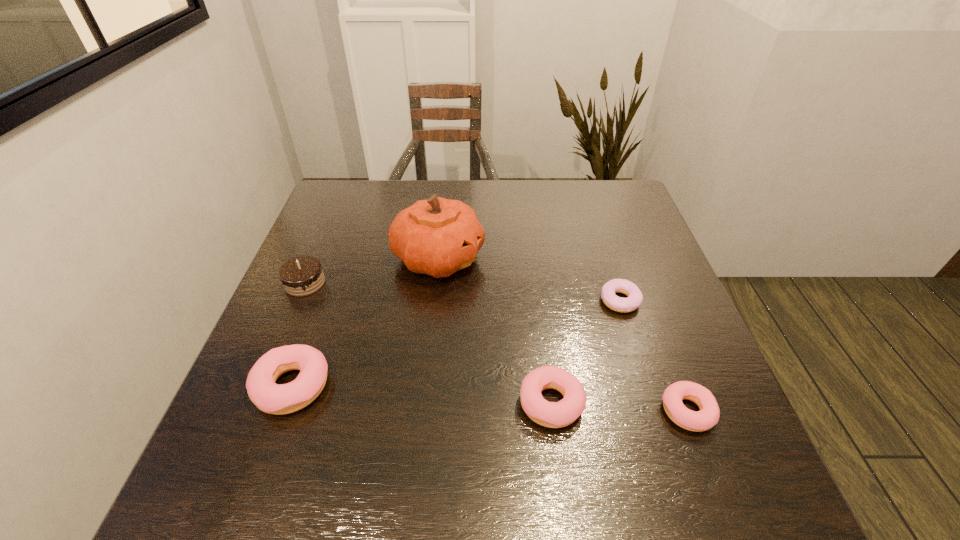
Where is `the second closest object relative to the farthest doughnut`? Image resolution: width=960 pixels, height=540 pixels. the second closest object relative to the farthest doughnut is located at coordinates (708, 416).

This screenshot has width=960, height=540. In order to click on the fourth closest object to the fourth object from right to left in this screenshot , I will do `click(619, 304)`.

The height and width of the screenshot is (540, 960). What are the coordinates of `the closest doughnut to the fourth object from left to right` in the screenshot? It's located at (708, 416).

Find the location of `doughnut that is the closest to the third tallest object`. doughnut that is the closest to the third tallest object is located at coordinates (559, 414).

The image size is (960, 540). Find the location of `free space that satisfies the following two spatial constraints: 1. on the front-facing side of the pumpkin; 2. on the left side of the farthest doughnut`. free space that satisfies the following two spatial constraints: 1. on the front-facing side of the pumpkin; 2. on the left side of the farthest doughnut is located at coordinates (434, 301).